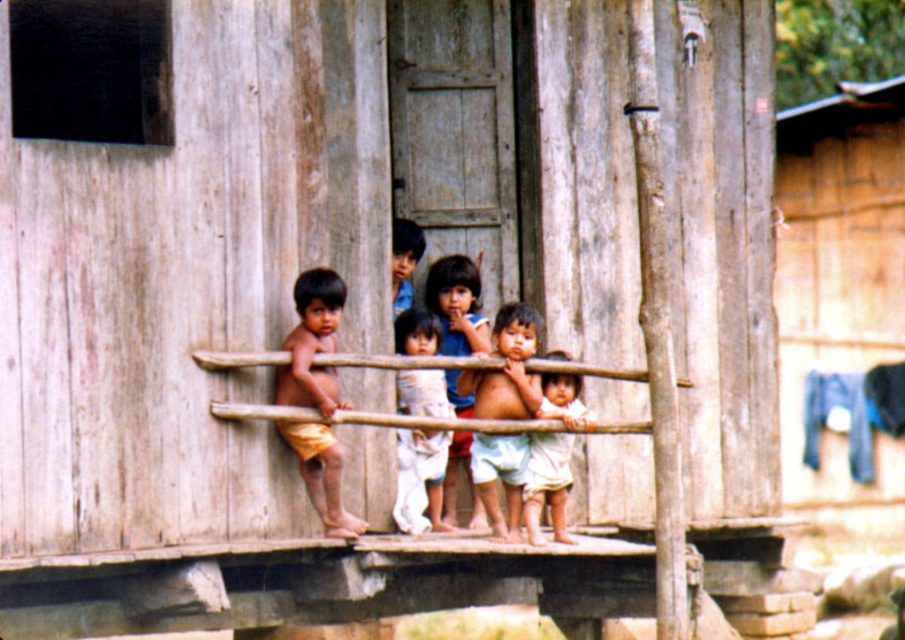
You are a photographer trying to capture a candid shot of the children on the wooden platform. You notice a specific point in the image at coordinates (456,305). What object or subject is located at this exact point?

The point at coordinates (456,305) is occupied by the smooth skin child at center.

You are a photographer trying to capture the children on the wooden platform. You notice the smooth skin child at center and the light beige cotton shirt at center. Which object should you focus on if you want to capture something taller?

The smooth skin child at center is taller than the light beige cotton shirt at center, so you should focus on the smooth skin child at center.